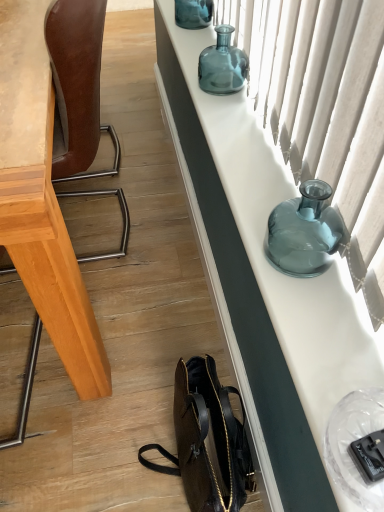
Question: Based on their positions, is translucent glass vase at upper center, the second bottle viewed from the front, located to the left or right of teal glass vase at upper center, the 3th bottle viewed from the front?

Choices:
 (A) left
 (B) right

Answer: (B)

Question: In terms of width, does translucent glass vase at upper center, the second bottle viewed from the front, look wider or thinner when compared to teal glass vase at upper center, the 3th bottle viewed from the front?

Choices:
 (A) wide
 (B) thin

Answer: (B)

Question: Based on their relative distances, which object is farther from the teal glass vase at upper center, marked as the first bottle in a back-to-front arrangement?

Choices:
 (A) translucent glass vase at upper center, the second bottle when ordered from bottom to top
 (B) brown leather chair at left
 (C) brown leather handbag at lower center
 (D) translucent glass vase at upper right, the first bottle positioned from the bottom
 (E) matte glass vase at upper right

Answer: (C)

Question: Which of these objects is positioned farthest from the brown leather chair at left?

Choices:
 (A) translucent fabric curtain at upper right
 (B) teal glass vase at upper center, the 1th bottle in the top-to-bottom sequence
 (C) brown leather handbag at lower center
 (D) translucent glass vase at upper center, the second bottle in the back-to-front sequence
 (E) translucent glass vase at upper right, the first bottle positioned from the bottom

Answer: (C)